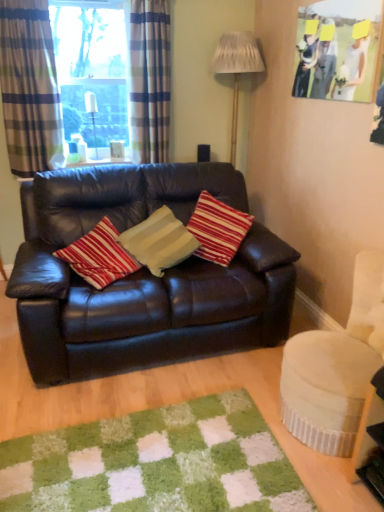
Question: From the image's perspective, would you say plaid fabric curtain at upper left, acting as the second curtain starting from the left, is positioned over shiny brown leather couch at center?

Choices:
 (A) no
 (B) yes

Answer: (B)

Question: Is plaid fabric curtain at upper left, acting as the second curtain starting from the left, at the right side of shiny brown leather couch at center?

Choices:
 (A) no
 (B) yes

Answer: (A)

Question: From a real-world perspective, is plaid fabric curtain at upper left, acting as the second curtain starting from the left, over shiny brown leather couch at center?

Choices:
 (A) no
 (B) yes

Answer: (B)

Question: Is plaid fabric curtain at upper left, positioned as the first curtain in right-to-left order, directly adjacent to shiny brown leather couch at center?

Choices:
 (A) no
 (B) yes

Answer: (A)

Question: Is plaid fabric curtain at upper left, positioned as the first curtain in right-to-left order, facing away from shiny brown leather couch at center?

Choices:
 (A) yes
 (B) no

Answer: (B)

Question: Considering the positions of shiny brown leather couch at center and matte paper picture frame at upper right in the image, is shiny brown leather couch at center bigger or smaller than matte paper picture frame at upper right?

Choices:
 (A) big
 (B) small

Answer: (A)

Question: Is shiny brown leather couch at center wider or thinner than matte paper picture frame at upper right?

Choices:
 (A) wide
 (B) thin

Answer: (A)

Question: Based on their positions, is shiny brown leather couch at center located to the left or right of matte paper picture frame at upper right?

Choices:
 (A) left
 (B) right

Answer: (A)

Question: From a real-world perspective, relative to matte paper picture frame at upper right, is shiny brown leather couch at center vertically above or below?

Choices:
 (A) above
 (B) below

Answer: (B)

Question: Considering the positions of clear glass window at upper left and shiny brown leather couch at center in the image, is clear glass window at upper left taller or shorter than shiny brown leather couch at center?

Choices:
 (A) tall
 (B) short

Answer: (A)

Question: Considering the positions of clear glass window at upper left and shiny brown leather couch at center in the image, is clear glass window at upper left bigger or smaller than shiny brown leather couch at center?

Choices:
 (A) small
 (B) big

Answer: (A)

Question: Considering the relative positions of clear glass window at upper left and shiny brown leather couch at center in the image provided, is clear glass window at upper left to the left or to the right of shiny brown leather couch at center?

Choices:
 (A) right
 (B) left

Answer: (B)

Question: From the image's perspective, is clear glass window at upper left located above or below shiny brown leather couch at center?

Choices:
 (A) above
 (B) below

Answer: (A)

Question: In the image, is striped fabric curtain at left, placed as the second curtain when sorted from right to left, positioned in front of or behind clear glass bottle at upper left, marked as the first lamp in a left-to-right arrangement?

Choices:
 (A) front
 (B) behind

Answer: (A)

Question: Considering the positions of striped fabric curtain at left, the 1th curtain viewed from the left, and clear glass bottle at upper left, which is the second lamp from right to left, in the image, is striped fabric curtain at left, the 1th curtain viewed from the left, bigger or smaller than clear glass bottle at upper left, which is the second lamp from right to left,?

Choices:
 (A) small
 (B) big

Answer: (B)